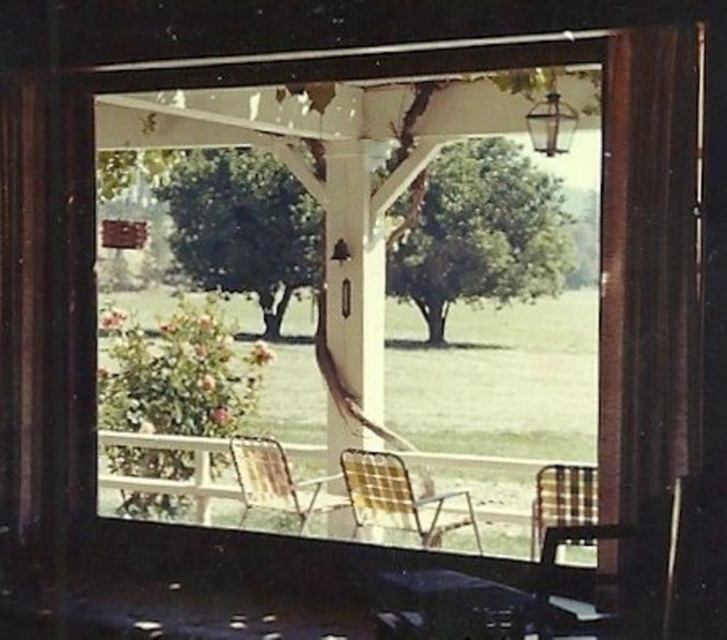
You are sitting on the plaid fabric rocking chair at lower right and want to move to the plaid fabric chair at right. In which direction should you move?

You should move to the right because the plaid fabric chair at right is located to the right of the plaid fabric rocking chair at lower right.

You are sitting on the porch and want to move from the plaid fabric chair at center to the plaid fabric chair at right. Which direction should you move to reach it?

You should move to the right because the plaid fabric chair at right is located to the right of the plaid fabric chair at center.

You are sitting on the porch and want to move from the rustic wood chair at center to the plaid fabric chair at right. Which direction should you move to reach it?

The rustic wood chair at center is located above the plaid fabric chair at right, so you should move downward to reach it.